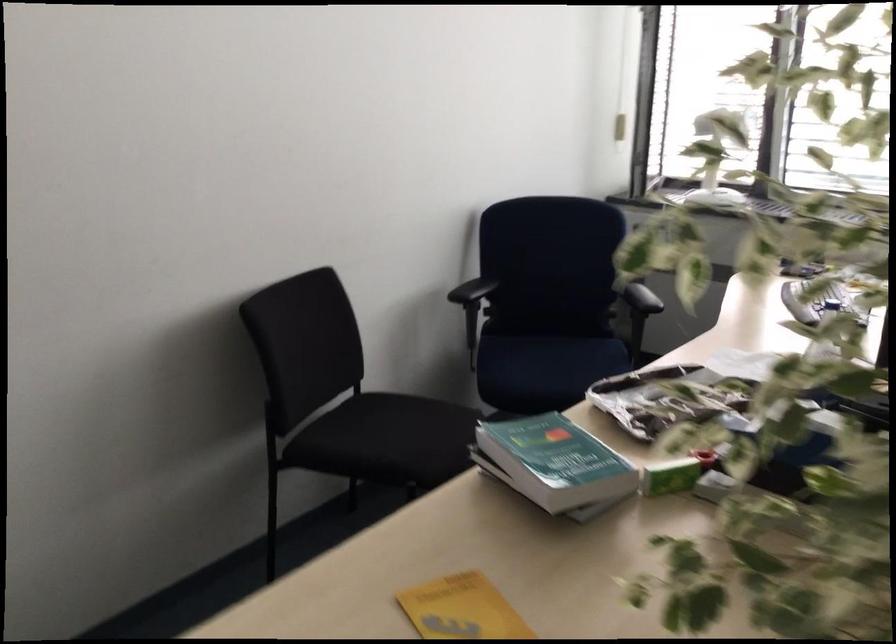
The image size is (896, 644). In order to click on blue chair sitting surface in this screenshot , I will do `click(547, 366)`.